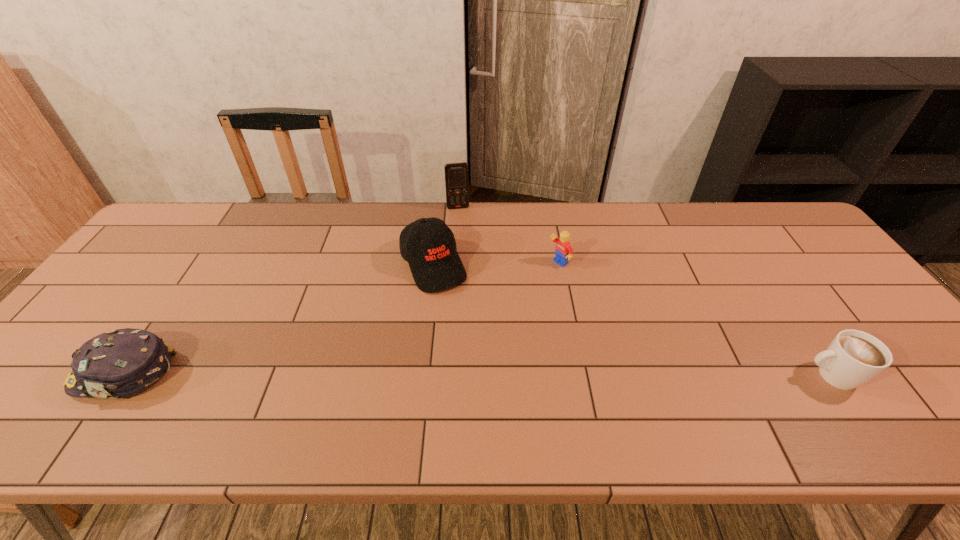
Locate an element on the screen. The image size is (960, 540). headwear is located at coordinates (119, 363).

Find the location of a particular element. The width and height of the screenshot is (960, 540). cappuccino is located at coordinates (853, 358).

Where is `the farthest object`? The height and width of the screenshot is (540, 960). the farthest object is located at coordinates (456, 174).

You are a GUI agent. You are given a task and a screenshot of the screen. Output one action in this format:
    pyautogui.click(x=<x>, y=<y>)
    Task: Click on the cellular telephone
    
    Given the screenshot: What is the action you would take?
    pyautogui.click(x=456, y=174)

Locate an element on the screen. This screenshot has height=540, width=960. the second object from right to left is located at coordinates (563, 251).

What are the coordinates of `baseball cap` in the screenshot? It's located at (435, 264).

Find the location of `free region located on the front-facing side of the headwear`. free region located on the front-facing side of the headwear is located at coordinates (40, 374).

Locate an element on the screen. vacant region located with the handle on the side of the rightmost object is located at coordinates (706, 376).

This screenshot has width=960, height=540. I want to click on free space located 0.120m with the handle on the side of the rightmost object, so click(x=750, y=376).

This screenshot has width=960, height=540. Identify the location of vacant space located with the handle on the side of the rightmost object. (714, 376).